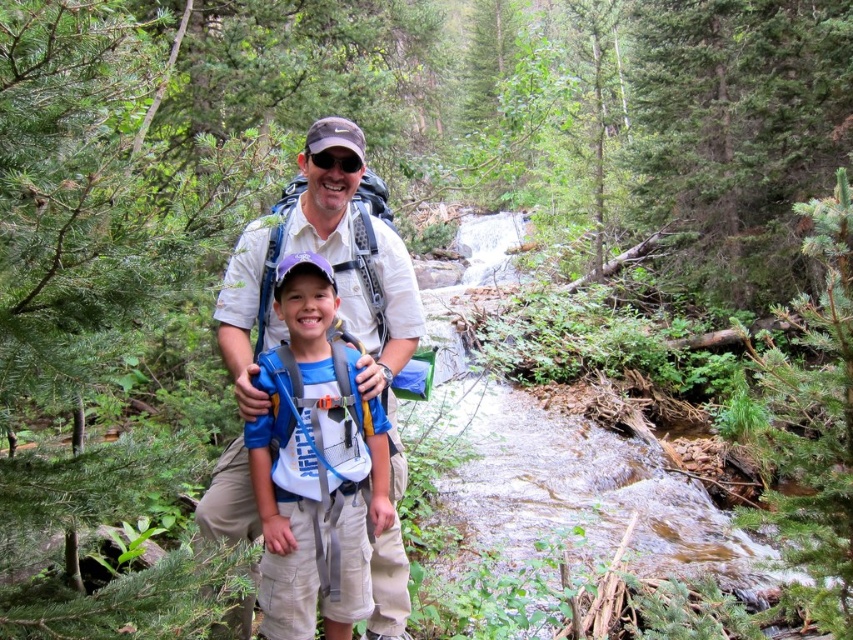
Question: Which object appears closest to the camera in this image?

Choices:
 (A) blue fabric backpack at center
 (B) light beige cotton shirt at center
 (C) black matte sunglasses at center

Answer: (B)

Question: Based on their relative distances, which object is nearer to the black matte sunglasses at center?

Choices:
 (A) blue fabric backpack at center
 (B) light beige cotton shirt at center

Answer: (B)

Question: Is light beige cotton shirt at center to the left of blue fabric backpack at center from the viewer's perspective?

Choices:
 (A) yes
 (B) no

Answer: (B)

Question: Considering the relative positions of light beige cotton shirt at center and blue fabric backpack at center in the image provided, where is light beige cotton shirt at center located with respect to blue fabric backpack at center?

Choices:
 (A) below
 (B) above

Answer: (B)

Question: Can you confirm if blue fabric backpack at center is positioned above black matte sunglasses at center?

Choices:
 (A) no
 (B) yes

Answer: (A)

Question: Which point is closer to the camera?

Choices:
 (A) light beige cotton shirt at center
 (B) black matte sunglasses at center

Answer: (A)